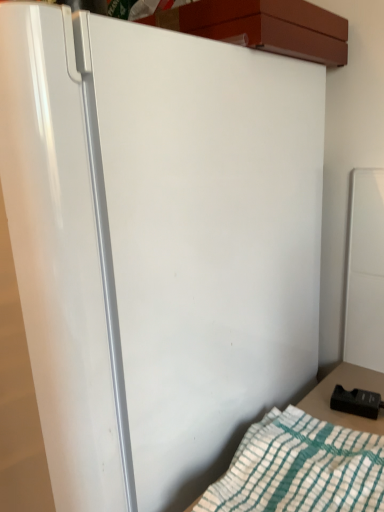
Question: From the image's perspective, would you say black plastic remote control at lower right is positioned over white cotton blanket at lower right?

Choices:
 (A) no
 (B) yes

Answer: (B)

Question: Considering the relative sizes of black plastic remote control at lower right and white cotton blanket at lower right in the image provided, is black plastic remote control at lower right bigger than white cotton blanket at lower right?

Choices:
 (A) no
 (B) yes

Answer: (A)

Question: Considering the relative sizes of black plastic remote control at lower right and white cotton blanket at lower right in the image provided, is black plastic remote control at lower right wider than white cotton blanket at lower right?

Choices:
 (A) yes
 (B) no

Answer: (B)

Question: Is black plastic remote control at lower right not near white cotton blanket at lower right?

Choices:
 (A) no
 (B) yes

Answer: (A)

Question: Does black plastic remote control at lower right have a greater height compared to white cotton blanket at lower right?

Choices:
 (A) no
 (B) yes

Answer: (B)

Question: Is black plastic remote control at lower right outside of white cotton blanket at lower right?

Choices:
 (A) no
 (B) yes

Answer: (B)

Question: From the image's perspective, is white cotton blanket at lower right located beneath black plastic remote control at lower right?

Choices:
 (A) no
 (B) yes

Answer: (B)

Question: From a real-world perspective, is white cotton blanket at lower right physically above black plastic remote control at lower right?

Choices:
 (A) yes
 (B) no

Answer: (A)

Question: Is white cotton blanket at lower right facing away from black plastic remote control at lower right?

Choices:
 (A) yes
 (B) no

Answer: (A)

Question: Would you consider white cotton blanket at lower right to be distant from black plastic remote control at lower right?

Choices:
 (A) no
 (B) yes

Answer: (A)

Question: Considering the relative sizes of white cotton blanket at lower right and black plastic remote control at lower right in the image provided, is white cotton blanket at lower right shorter than black plastic remote control at lower right?

Choices:
 (A) yes
 (B) no

Answer: (A)

Question: Considering the relative positions of white cotton blanket at lower right and black plastic remote control at lower right in the image provided, is white cotton blanket at lower right behind black plastic remote control at lower right?

Choices:
 (A) yes
 (B) no

Answer: (B)

Question: Relative to white cotton blanket at lower right, is black plastic remote control at lower right in front or behind?

Choices:
 (A) front
 (B) behind

Answer: (B)